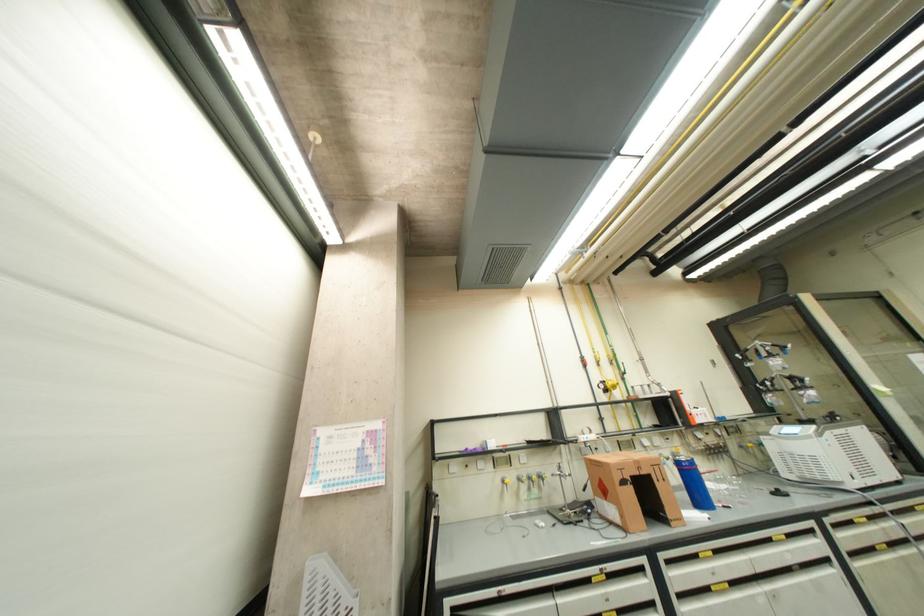
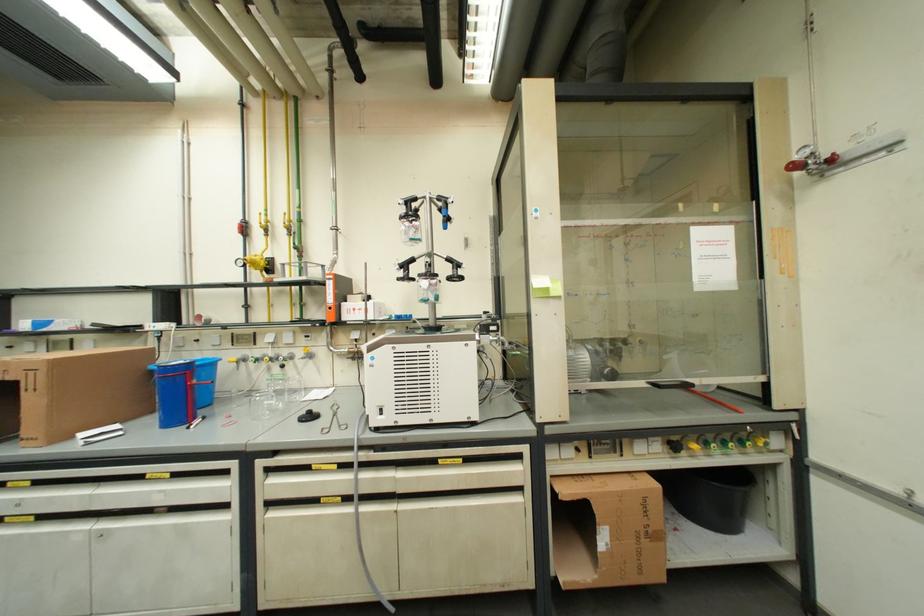
Question: Which direction would the cameraman need to move to produce the second image? Reply with the corresponding letter.

Choices:
 (A) Left
 (B) Right
 (C) Forward
 (D) Backward

Answer: (B)